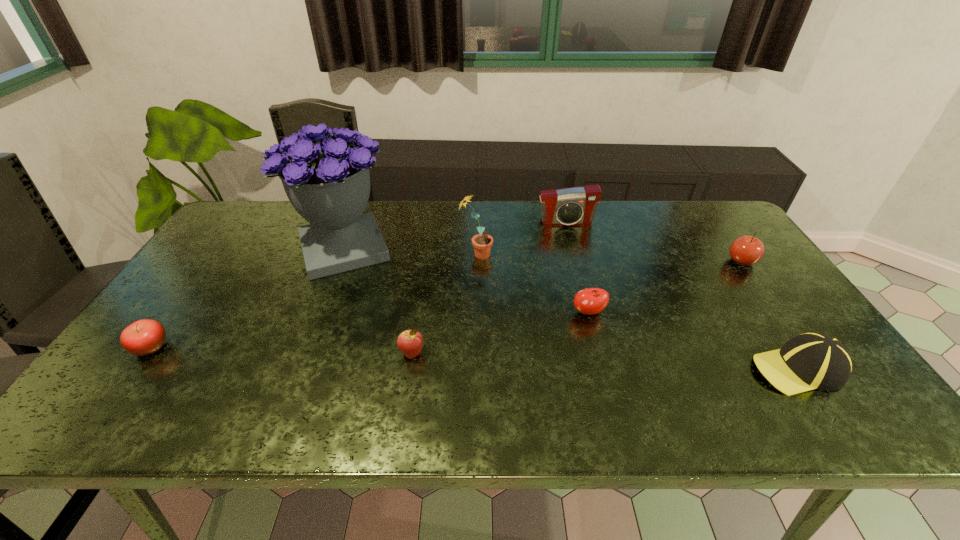
Find the location of `free space that satisfies the following two spatial constraints: 1. on the back side of the farthest apple; 2. on the flower of the sunflower`. free space that satisfies the following two spatial constraints: 1. on the back side of the farthest apple; 2. on the flower of the sunflower is located at coordinates (737, 255).